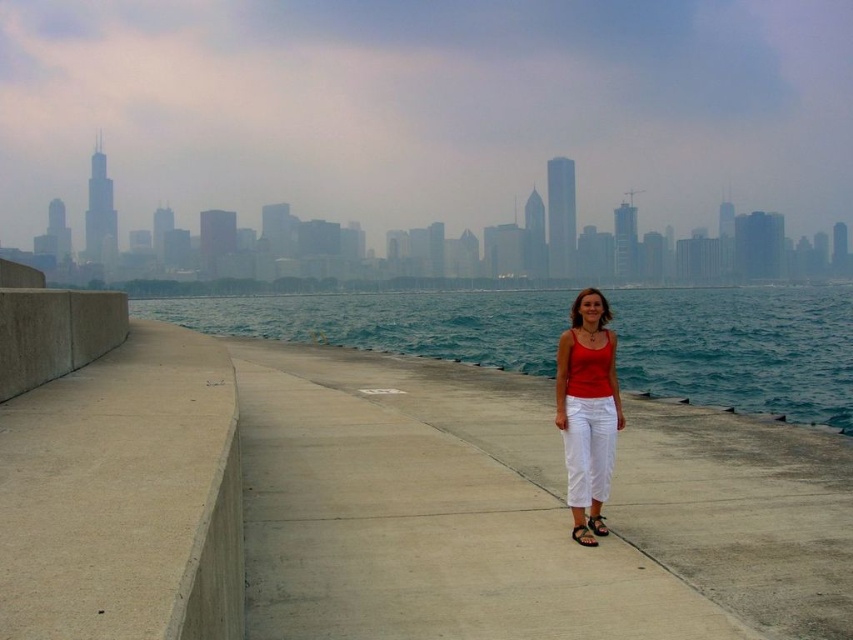
Question: From the image, what is the correct spatial relationship of concrete at center in relation to black rubber sandal at center?

Choices:
 (A) below
 (B) above

Answer: (B)

Question: Which object is positioned farthest from the black rubber sandal at center?

Choices:
 (A) black leather sandal at center
 (B) matte red tank top at center
 (C) blue water at center
 (D) concrete at center

Answer: (C)

Question: Can you confirm if black leather sandal at center is thinner than black rubber sandal at center?

Choices:
 (A) no
 (B) yes

Answer: (A)

Question: Estimate the real-world distances between objects in this image. Which object is farther from the concrete at center?

Choices:
 (A) blue water at center
 (B) matte red tank top at center
 (C) black leather sandal at center

Answer: (A)

Question: Which of the following is the farthest from the observer?

Choices:
 (A) concrete at center
 (B) blue water at center
 (C) matte red tank top at center
 (D) black rubber sandal at center

Answer: (B)

Question: Does blue water at center appear under black leather sandal at center?

Choices:
 (A) yes
 (B) no

Answer: (B)